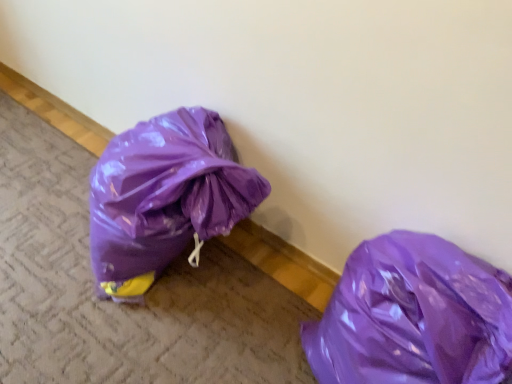
Find the location of a particular element. vacant space in glossy plastic bag at lower left (from a real-world perspective) is located at coordinates (72, 264).